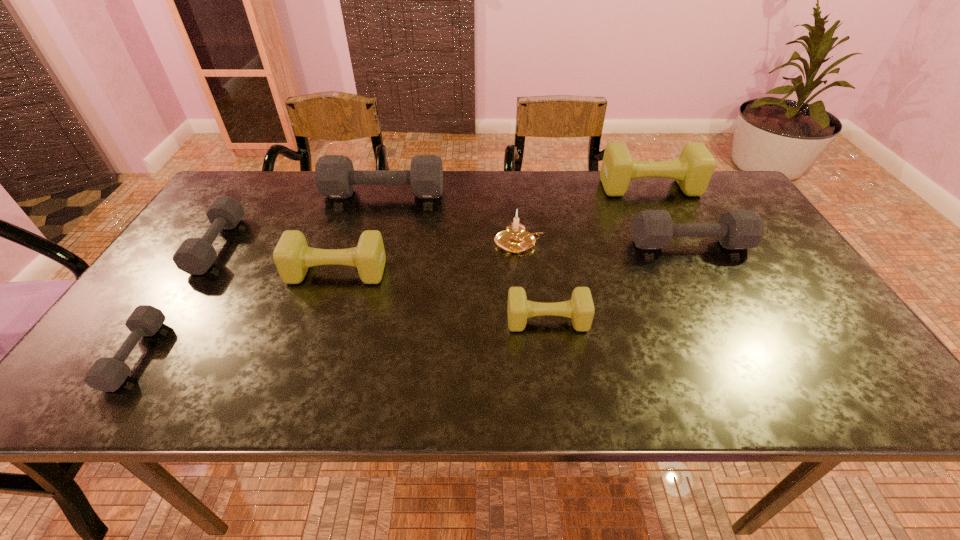
The image size is (960, 540). I want to click on the biggest olive dumbbell, so click(x=693, y=170).

You are a GUI agent. You are given a task and a screenshot of the screen. Output one action in this format:
    pyautogui.click(x=<x>, y=<y>)
    Task: Click on the farthest olive dumbbell
    This screenshot has width=960, height=540.
    Given the screenshot: What is the action you would take?
    pyautogui.click(x=693, y=170)

Locate an element on the screen. the third gray dumbbell from left to right is located at coordinates (335, 177).

The width and height of the screenshot is (960, 540). Identify the location of the farthest gray dumbbell. (335, 177).

At what (x,y) coordinates should I click in order to perform the action: click on candle holder. Please return your answer as a coordinate pair (x, y). This screenshot has height=540, width=960. Looking at the image, I should click on (515, 239).

At what (x,y) coordinates should I click in order to perform the action: click on the second smallest olive dumbbell. Please return your answer as a coordinate pair (x, y). The height and width of the screenshot is (540, 960). Looking at the image, I should click on (292, 256).

The image size is (960, 540). In order to click on the leftmost olive dumbbell in this screenshot , I will do `click(292, 256)`.

This screenshot has height=540, width=960. I want to click on the rightmost gray dumbbell, so click(x=652, y=229).

At what (x,y) coordinates should I click in order to perform the action: click on the third biggest gray dumbbell. Please return your answer as a coordinate pair (x, y). Image resolution: width=960 pixels, height=540 pixels. Looking at the image, I should click on (195, 256).

The image size is (960, 540). Identify the location of the fifth dumbbell from left to right. (580, 308).